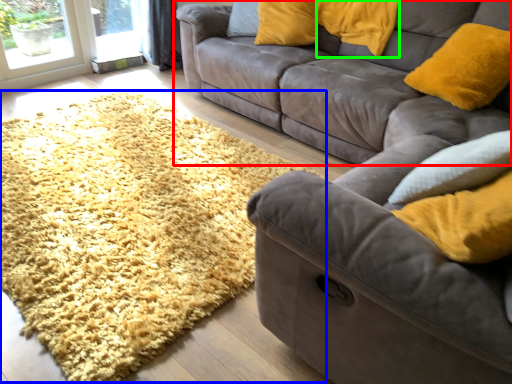
Question: Based on their relative distances, which object is farther from studio couch (highlighted by a red box)? Choose from mat (highlighted by a blue box) and pillow (highlighted by a green box).

Choices:
 (A) mat
 (B) pillow

Answer: (A)